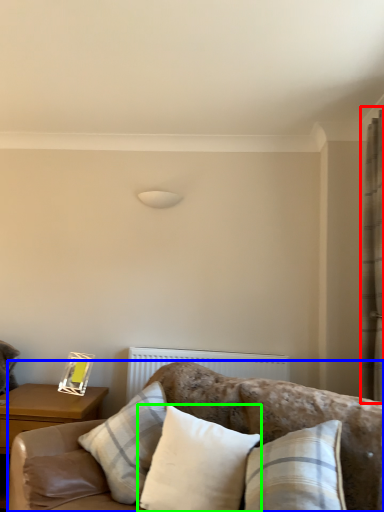
Question: Which object is the farthest from curtain (highlighted by a red box)? Choose among these: studio couch (highlighted by a blue box) or pillow (highlighted by a green box).

Choices:
 (A) studio couch
 (B) pillow

Answer: (B)